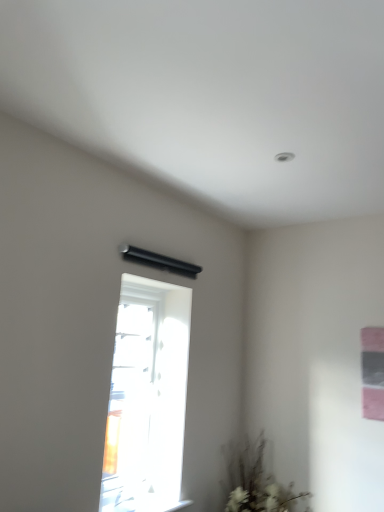
Question: From a real-world perspective, does white matte plant at lower right stand above transparent glass window at center?

Choices:
 (A) yes
 (B) no

Answer: (B)

Question: Can you confirm if white matte plant at lower right is thinner than transparent glass window at center?

Choices:
 (A) no
 (B) yes

Answer: (A)

Question: Does white matte plant at lower right have a smaller size compared to transparent glass window at center?

Choices:
 (A) no
 (B) yes

Answer: (B)

Question: Does white matte plant at lower right come behind transparent glass window at center?

Choices:
 (A) yes
 (B) no

Answer: (A)

Question: Considering the relative positions of white matte plant at lower right and transparent glass window at center in the image provided, is white matte plant at lower right in front of transparent glass window at center?

Choices:
 (A) yes
 (B) no

Answer: (B)

Question: Does white matte plant at lower right appear on the right side of transparent glass window at center?

Choices:
 (A) yes
 (B) no

Answer: (A)

Question: From a real-world perspective, is transparent glass window at center on top of white matte plant at lower right?

Choices:
 (A) no
 (B) yes

Answer: (B)

Question: Is transparent glass window at center facing towards white matte plant at lower right?

Choices:
 (A) no
 (B) yes

Answer: (A)

Question: From a real-world perspective, is transparent glass window at center physically below white matte plant at lower right?

Choices:
 (A) yes
 (B) no

Answer: (B)

Question: Is transparent glass window at center closer to camera compared to white matte plant at lower right?

Choices:
 (A) yes
 (B) no

Answer: (A)

Question: Is transparent glass window at center facing away from white matte plant at lower right?

Choices:
 (A) no
 (B) yes

Answer: (A)

Question: Does transparent glass window at center have a greater width compared to white matte plant at lower right?

Choices:
 (A) no
 (B) yes

Answer: (A)

Question: Relative to white matte plant at lower right, is transparent glass window at center in front or behind?

Choices:
 (A) behind
 (B) front

Answer: (B)